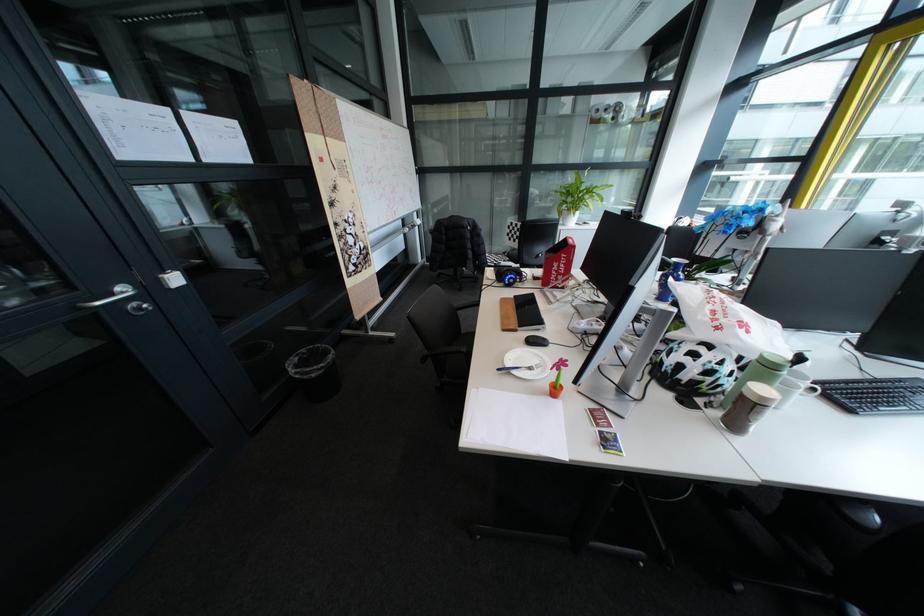
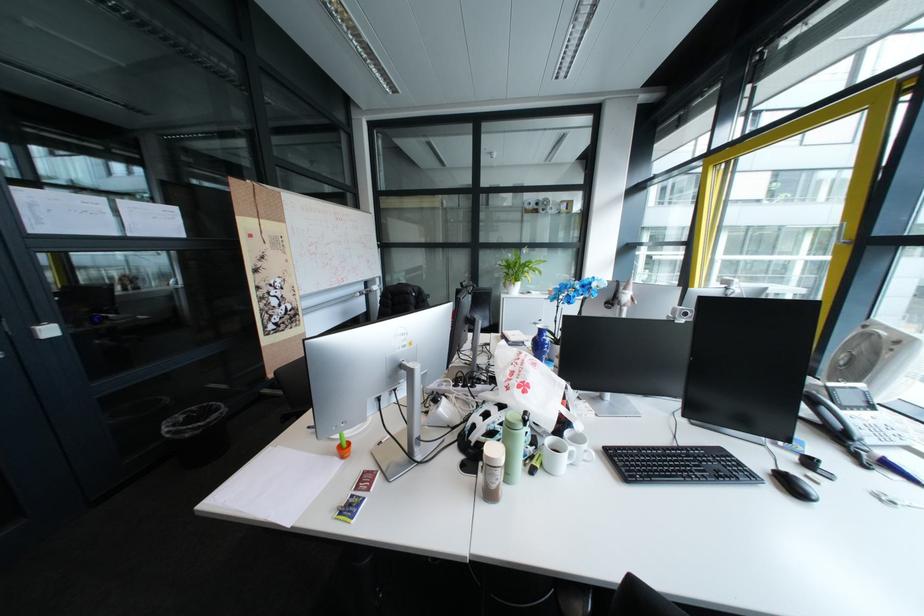
Question: Based on the continuous images, in which direction is the camera rotating? Reply with the corresponding letter.

Choices:
 (A) Left
 (B) Right
 (C) Up
 (D) Down

Answer: (C)